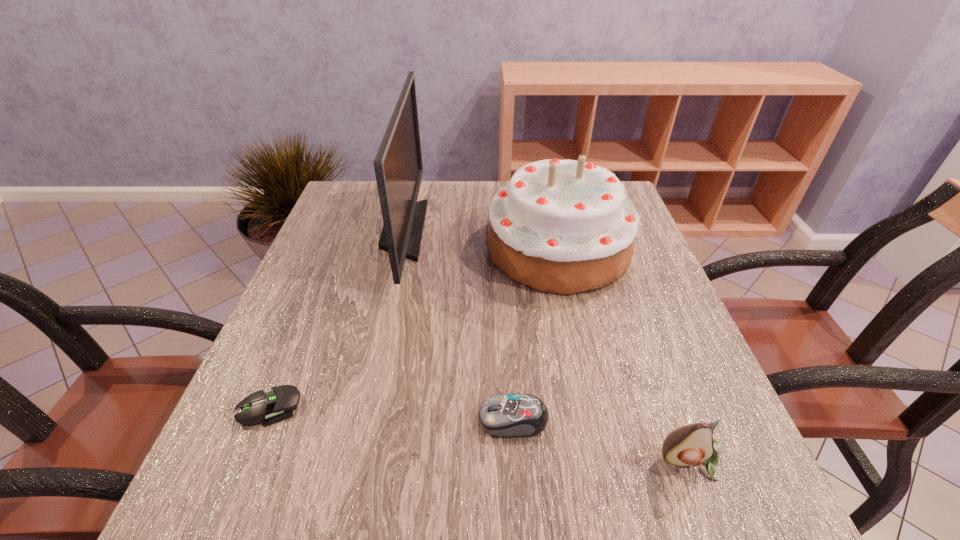
Locate an element on the screen. The width and height of the screenshot is (960, 540). vacant space that's between the shortest object and the taller computer mouse is located at coordinates (392, 413).

At what (x,y) coordinates should I click in order to perform the action: click on object that is the fourth closest to the second object from left to right. Please return your answer as a coordinate pair (x, y). The width and height of the screenshot is (960, 540). Looking at the image, I should click on (693, 444).

What are the coordinates of `object that can be found as the third closest to the fourth tallest object` in the screenshot? It's located at (398, 166).

I want to click on blank space that satisfies the following two spatial constraints: 1. on the screen side of the tallest object; 2. on the back side of the cake, so click(399, 248).

I want to click on free spot that satisfies the following two spatial constraints: 1. on the screen side of the tallest object; 2. on the back side of the second tallest object, so click(399, 248).

Find the location of `vacant space that satisfies the following two spatial constraints: 1. on the screen side of the tallest object; 2. on the back side of the second tallest object`. vacant space that satisfies the following two spatial constraints: 1. on the screen side of the tallest object; 2. on the back side of the second tallest object is located at coordinates (399, 248).

Find the location of a particular element. The image size is (960, 540). free space that satisfies the following two spatial constraints: 1. on the back side of the cake; 2. on the screen side of the fourth object from right to left is located at coordinates (554, 231).

You are a GUI agent. You are given a task and a screenshot of the screen. Output one action in this format:
    pyautogui.click(x=<x>, y=<y>)
    Task: Click on the blank area in the image that satisfies the following two spatial constraints: 1. on the screen side of the second object from left to right; 2. on the front side of the leftmost object
    
    Given the screenshot: What is the action you would take?
    pyautogui.click(x=364, y=406)